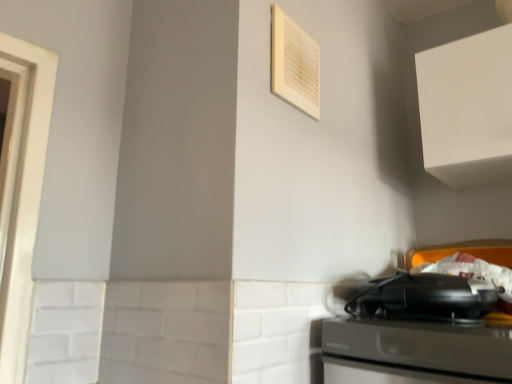
Find the location of a particular element. The height and width of the screenshot is (384, 512). white plastic air conditioner at upper center is located at coordinates (294, 64).

Identify the location of white matte cabinet at upper right. The image size is (512, 384). (467, 109).

Is black plastic toaster at lower right positioned in front of white plastic air conditioner at upper center?

Yes, it is in front of white plastic air conditioner at upper center.

Based on the photo, who is taller, black plastic toaster at lower right or white plastic air conditioner at upper center?

white plastic air conditioner at upper center is taller.

At what (x,y) coordinates should I click in order to perform the action: click on appliance below the white plastic air conditioner at upper center (from a real-world perspective). Please return your answer as a coordinate pair (x, y). The height and width of the screenshot is (384, 512). Looking at the image, I should click on (424, 298).

Is black plastic toaster at lower right facing towards white plastic air conditioner at upper center?

No, black plastic toaster at lower right is not turned towards white plastic air conditioner at upper center.

From a real-world perspective, between white plastic air conditioner at upper center and white matte cabinet at upper right, who is vertically higher?

white matte cabinet at upper right.

Is white plastic air conditioner at upper center bigger than white matte cabinet at upper right?

Actually, white plastic air conditioner at upper center might be smaller than white matte cabinet at upper right.

Is white plastic air conditioner at upper center turned away from white matte cabinet at upper right?

That's not correct — white plastic air conditioner at upper center is not looking away from white matte cabinet at upper right.

I want to click on cabinetry on the right of white plastic air conditioner at upper center, so click(467, 109).

Which is closer to the camera, (461, 167) or (303, 67)?

Positioned in front is point (303, 67).

From the image's perspective, which is above, white matte cabinet at upper right or white plastic air conditioner at upper center?

white plastic air conditioner at upper center, from the image's perspective.

Between white matte cabinet at upper right and white plastic air conditioner at upper center, which one has smaller size?

With smaller size is white plastic air conditioner at upper center.

From a real-world perspective, between black plastic toaster at lower right and white matte cabinet at upper right, who is vertically higher?

white matte cabinet at upper right is physically above.

In the image, there is a white matte cabinet at upper right. Where is `appliance below it (from the image's perspective)`? Image resolution: width=512 pixels, height=384 pixels. appliance below it (from the image's perspective) is located at coordinates (424, 298).

Is black plastic toaster at lower right bigger than white matte cabinet at upper right?

Actually, black plastic toaster at lower right might be smaller than white matte cabinet at upper right.

Is black plastic toaster at lower right turned away from white matte cabinet at upper right?

No, black plastic toaster at lower right's orientation is not away from white matte cabinet at upper right.

How different are the orientations of white plastic air conditioner at upper center and black plastic toaster at lower right in degrees?

The angular difference between white plastic air conditioner at upper center and black plastic toaster at lower right is 94.6 degrees.

Looking at this image, is white plastic air conditioner at upper center looking in the opposite direction of black plastic toaster at lower right?

No, black plastic toaster at lower right is not at the back of white plastic air conditioner at upper center.

Which is behind, white plastic air conditioner at upper center or black plastic toaster at lower right?

white plastic air conditioner at upper center is further away from the camera.

Considering the relative sizes of white plastic air conditioner at upper center and black plastic toaster at lower right in the image provided, is white plastic air conditioner at upper center thinner than black plastic toaster at lower right?

Indeed, white plastic air conditioner at upper center has a lesser width compared to black plastic toaster at lower right.

Between white matte cabinet at upper right and black plastic toaster at lower right, which one appears on the left side from the viewer's perspective?

black plastic toaster at lower right.

From a real-world perspective, is white matte cabinet at upper right above or below black plastic toaster at lower right?

Clearly, from a real-world perspective, white matte cabinet at upper right is above black plastic toaster at lower right.

Find the location of a particular element. Image resolution: width=512 pixels, height=384 pixels. appliance in front of the white plastic air conditioner at upper center is located at coordinates (424, 298).

The width and height of the screenshot is (512, 384). I want to click on cabinetry below the white plastic air conditioner at upper center (from the image's perspective), so click(467, 109).

Looking at the image, which one is located further to white plastic air conditioner at upper center, white matte cabinet at upper right or black plastic toaster at lower right?

black plastic toaster at lower right is further to white plastic air conditioner at upper center.

Based on their spatial positions, is white plastic air conditioner at upper center or white matte cabinet at upper right closer to black plastic toaster at lower right?

white matte cabinet at upper right is positioned closer to the anchor black plastic toaster at lower right.

Estimate the real-world distances between objects in this image. Which object is further from white plastic air conditioner at upper center, black plastic toaster at lower right or white matte cabinet at upper right?

The object further to white plastic air conditioner at upper center is black plastic toaster at lower right.

Considering their positions, is white plastic air conditioner at upper center positioned closer to white matte cabinet at upper right than black plastic toaster at lower right?

black plastic toaster at lower right is closer to white matte cabinet at upper right.

Looking at the image, which one is located closer to white matte cabinet at upper right, black plastic toaster at lower right or white plastic air conditioner at upper center?

Based on the image, black plastic toaster at lower right appears to be nearer to white matte cabinet at upper right.

When comparing their distances from black plastic toaster at lower right, does white matte cabinet at upper right or white plastic air conditioner at upper center seem further?

The object further to black plastic toaster at lower right is white plastic air conditioner at upper center.

Find the location of a particular element. Image resolution: width=512 pixels, height=384 pixels. appliance situated between white plastic air conditioner at upper center and white matte cabinet at upper right from left to right is located at coordinates (x=424, y=298).